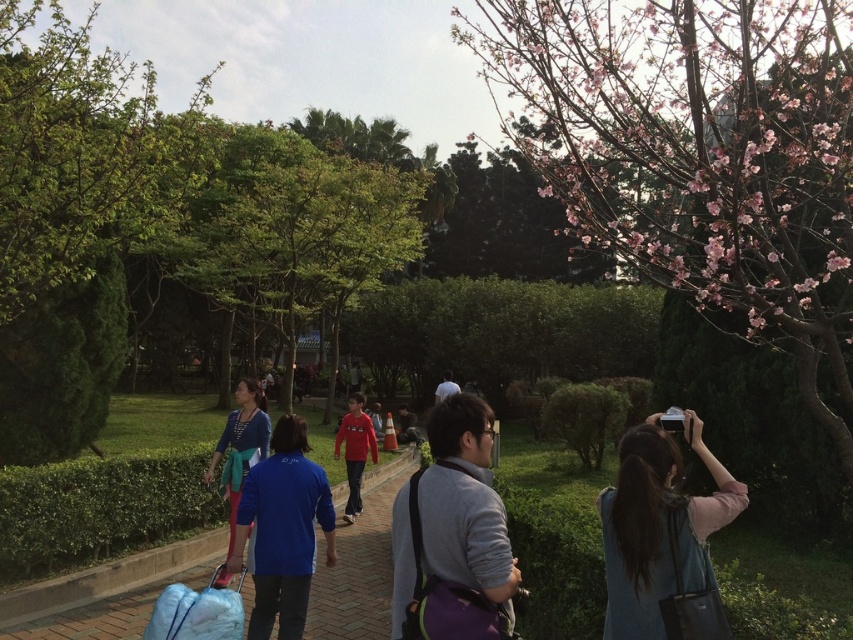
Question: Does pink fabric at center appear on the right side of blue fabric bag at center?

Choices:
 (A) no
 (B) yes

Answer: (B)

Question: Which point appears farthest from the camera in this image?

Choices:
 (A) (228, 492)
 (B) (776, 113)
 (C) (323, 492)

Answer: (A)

Question: Which point is closer to the camera?

Choices:
 (A) (659, 621)
 (B) (286, 461)
 (C) (654, 282)

Answer: (A)

Question: Which of the following is the farthest from the observer?

Choices:
 (A) gray fabric backpack at center
 (B) blue fabric jacket at center

Answer: (B)

Question: Does gray fabric backpack at center appear on the left side of blue fabric jacket at center?

Choices:
 (A) no
 (B) yes

Answer: (A)

Question: Is pink blossoms at upper right wider than blue fabric bag at center?

Choices:
 (A) no
 (B) yes

Answer: (B)